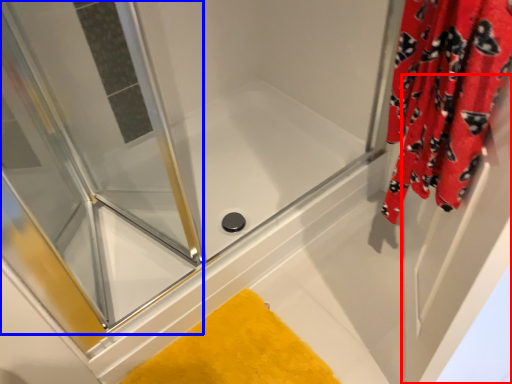
Question: Which point is closer to the camera, screen door (highlighted by a red box) or screen door (highlighted by a blue box)?

Choices:
 (A) screen door
 (B) screen door

Answer: (A)